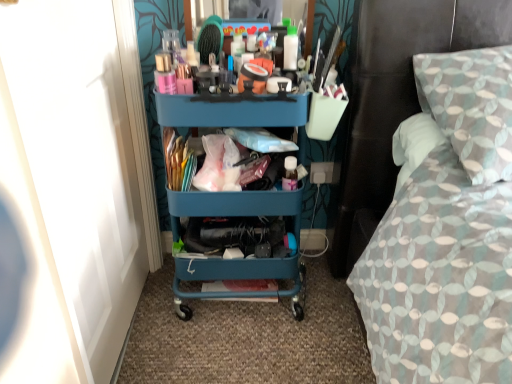
Question: Should I look upward or downward to see textured fabric bed at right?

Choices:
 (A) up
 (B) down

Answer: (A)

Question: Is textured fabric bed at right bigger than teal plastic cart at center?

Choices:
 (A) no
 (B) yes

Answer: (B)

Question: Is textured fabric bed at right oriented towards teal plastic cart at center?

Choices:
 (A) yes
 (B) no

Answer: (B)

Question: Is textured fabric bed at right shorter than teal plastic cart at center?

Choices:
 (A) no
 (B) yes

Answer: (B)

Question: Does textured fabric bed at right have a lesser width compared to teal plastic cart at center?

Choices:
 (A) no
 (B) yes

Answer: (A)

Question: Does textured fabric bed at right appear on the right side of teal plastic cart at center?

Choices:
 (A) no
 (B) yes

Answer: (B)

Question: Is textured fabric bed at right in front of teal plastic cart at center?

Choices:
 (A) no
 (B) yes

Answer: (B)

Question: Considering the relative sizes of white plastic power outlet at lower right and teal plastic cart at center in the image provided, is white plastic power outlet at lower right bigger than teal plastic cart at center?

Choices:
 (A) yes
 (B) no

Answer: (B)

Question: From a real-world perspective, is white plastic power outlet at lower right on teal plastic cart at center?

Choices:
 (A) no
 (B) yes

Answer: (A)

Question: Does white plastic power outlet at lower right lie in front of teal plastic cart at center?

Choices:
 (A) no
 (B) yes

Answer: (A)

Question: Is teal plastic cart at center located within white plastic power outlet at lower right?

Choices:
 (A) yes
 (B) no

Answer: (B)

Question: Is white plastic power outlet at lower right far from teal plastic cart at center?

Choices:
 (A) yes
 (B) no

Answer: (B)

Question: Considering the relative sizes of white plastic power outlet at lower right and teal plastic cart at center in the image provided, is white plastic power outlet at lower right taller than teal plastic cart at center?

Choices:
 (A) no
 (B) yes

Answer: (A)

Question: Can you confirm if textured fabric bed at right is bigger than white plastic power outlet at lower right?

Choices:
 (A) no
 (B) yes

Answer: (B)